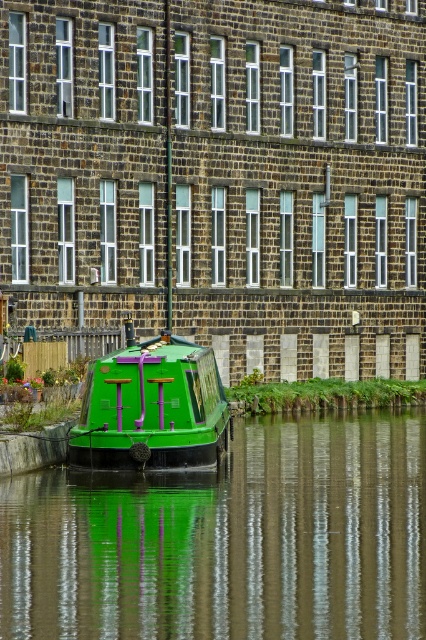
You are standing on the canal boat and want to move from the point at coordinates point (172,588) to the point at coordinates point (207,387). Which direction should you move to get closer to the building in the background?

You should move towards point (207,387) because it is behind point (172,588), so moving in that direction will bring you closer to the building in the background.

You are standing on the dock and see the green glossy boat at lower left and the green matte boat at center. Which boat is closer to you?

The green glossy boat at lower left is closer to you because it is positioned in front of the green matte boat at center.